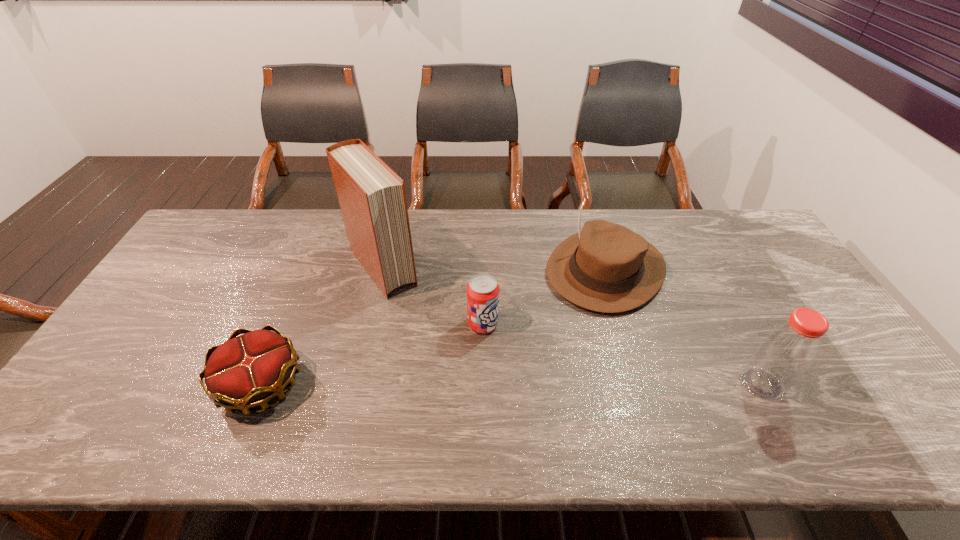
This screenshot has width=960, height=540. What are the coordinates of `free space located on the feather side of the fedora` in the screenshot? It's located at (508, 373).

Find the location of a particular element. The width and height of the screenshot is (960, 540). hardback book present at the far edge is located at coordinates pos(372,198).

Locate an element on the screen. This screenshot has width=960, height=540. fedora situated at the far edge is located at coordinates coord(606,267).

This screenshot has height=540, width=960. Identify the location of crown located in the near edge section of the desktop. (246, 371).

Identify the location of bottle located in the near edge section of the desktop. This screenshot has height=540, width=960. (786, 352).

Locate an element on the screen. The width and height of the screenshot is (960, 540). free space at the far edge is located at coordinates (513, 238).

Locate an element on the screen. blank space at the near edge is located at coordinates (302, 390).

In the image, there is a desktop. Where is `vacant space at the far left corner`? vacant space at the far left corner is located at coordinates (243, 216).

Find the location of a particular element. The width and height of the screenshot is (960, 540). vacant space at the far right corner of the desktop is located at coordinates (725, 248).

Locate an element on the screen. The width and height of the screenshot is (960, 540). free space at the near right corner of the desktop is located at coordinates point(858,381).